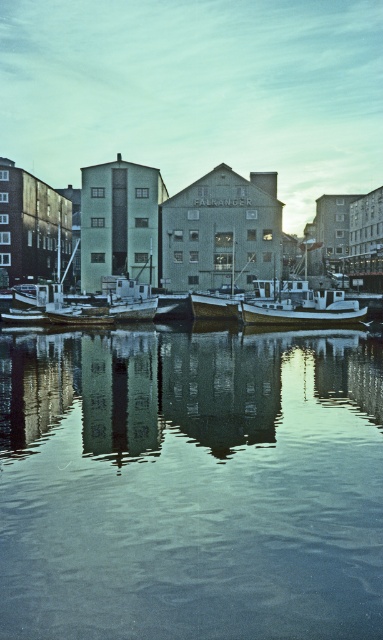
Question: Is smooth reflective water at center above white matte boat at center?

Choices:
 (A) yes
 (B) no

Answer: (B)

Question: Is smooth reflective water at center to the left of white matte boat at center from the viewer's perspective?

Choices:
 (A) no
 (B) yes

Answer: (B)

Question: In this image, where is smooth reflective water at center located relative to white matte boat at center?

Choices:
 (A) below
 (B) above

Answer: (A)

Question: Which of the following is the closest to the observer?

Choices:
 (A) (178, 529)
 (B) (294, 307)

Answer: (A)